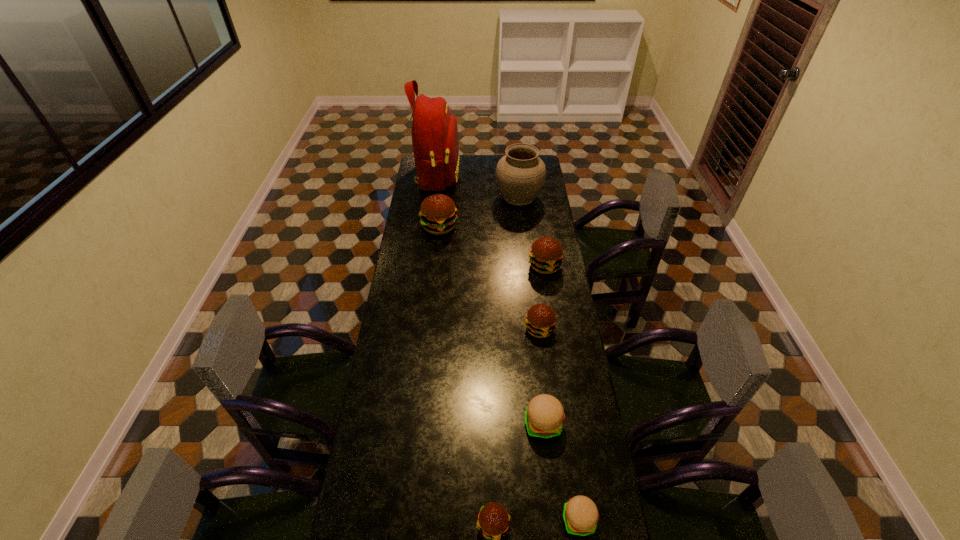
Locate an element on the screen. Image resolution: width=960 pixels, height=540 pixels. empty location between the biggest brown hamburger and the fourth tallest object is located at coordinates (492, 246).

You are a GUI agent. You are given a task and a screenshot of the screen. Output one action in this format:
    pyautogui.click(x=<x>, y=<y>)
    Task: Click on the free spot between the smaller beige hamburger and the third nearest hamburger
    Image resolution: width=960 pixels, height=540 pixels.
    Given the screenshot: What is the action you would take?
    pyautogui.click(x=562, y=472)

You are a GUI agent. You are given a task and a screenshot of the screen. Output one action in this format:
    pyautogui.click(x=<x>, y=<y>)
    Task: Click on the empty location between the fifth shortest object and the biggest brown hamburger
    
    Given the screenshot: What is the action you would take?
    pyautogui.click(x=492, y=246)

I want to click on free spot between the farthest hamburger and the seventh shortest object, so click(x=479, y=212).

Find the location of a particular element. The width and height of the screenshot is (960, 540). vacant space that's between the fourth farthest hamburger and the second smallest brown hamburger is located at coordinates (541, 376).

Locate which object is the second closest to the third biggest brown hamburger. Please provide its 2D coordinates. Your answer should be formatted as a tuple, i.e. [(x, y)], where the tuple contains the x and y coordinates of a point satisfying the conditions above.

[(544, 417)]

Find the location of a particular element. The width and height of the screenshot is (960, 540). object identified as the sixth closest to the second tallest object is located at coordinates (580, 514).

I want to click on the fifth closest hamburger to the urn, so pyautogui.click(x=580, y=514).

I want to click on the second closest hamburger to the urn, so click(546, 253).

Select which brown hamburger appears as the closest to the nearer beige hamburger. Please provide its 2D coordinates. Your answer should be formatted as a tuple, i.e. [(x, y)], where the tuple contains the x and y coordinates of a point satisfying the conditions above.

[(493, 521)]